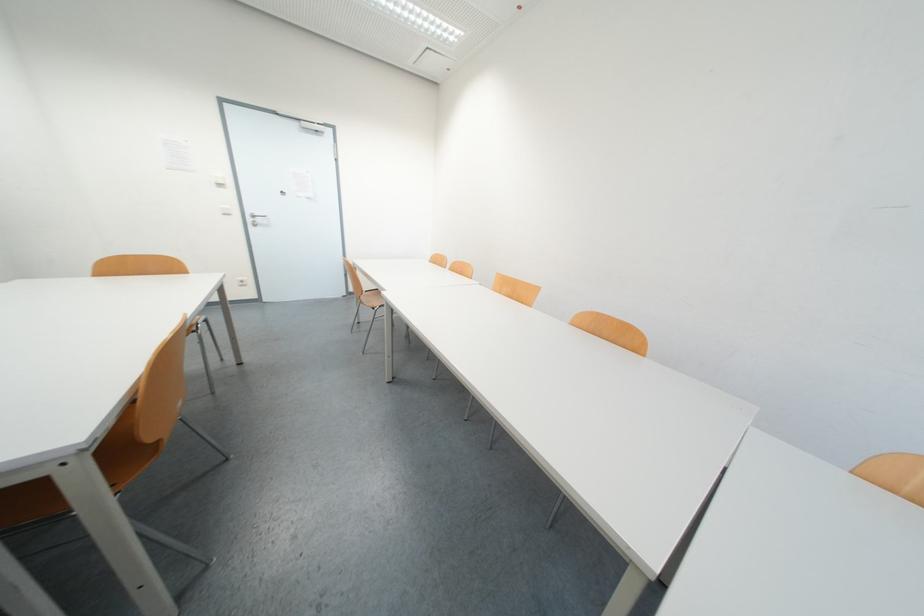
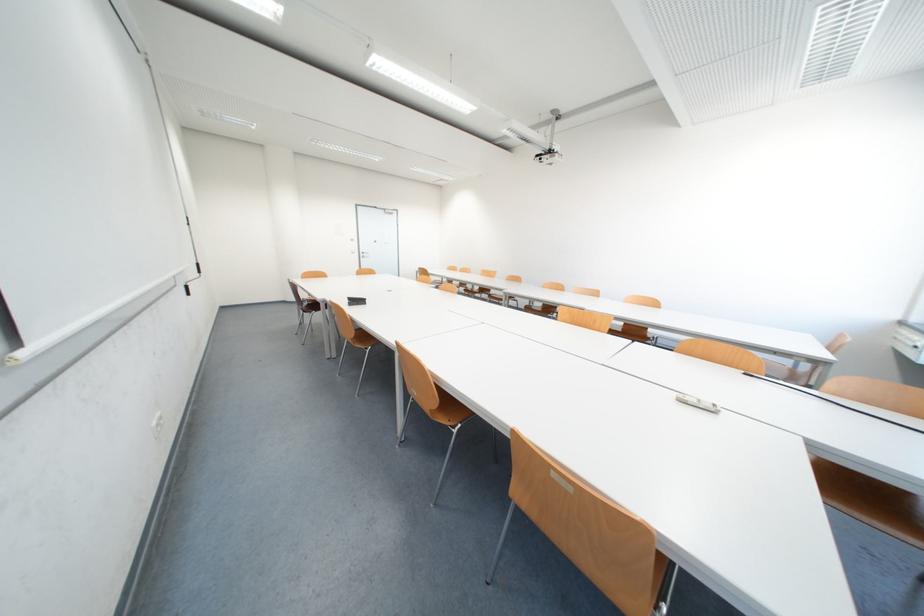
Question: In a continuous first-person perspective shot, in which direction is the camera moving?

Choices:
 (A) Left
 (B) Right
 (C) Forward
 (D) Backward

Answer: (D)